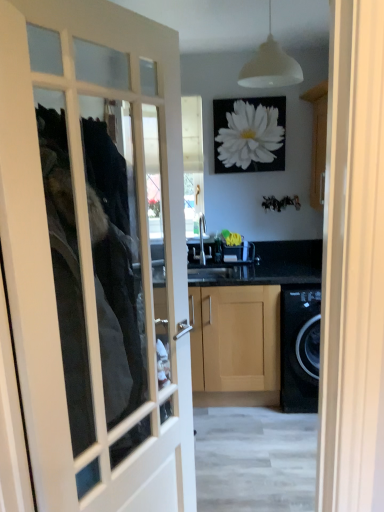
Question: Does white matte light fixture at upper center appear on the right side of white matte flower at upper center?

Choices:
 (A) yes
 (B) no

Answer: (B)

Question: Is white matte flower at upper center completely or partially inside white matte light fixture at upper center?

Choices:
 (A) yes
 (B) no

Answer: (B)

Question: Is white matte light fixture at upper center facing towards white matte flower at upper center?

Choices:
 (A) yes
 (B) no

Answer: (B)

Question: From the image's perspective, would you say white matte light fixture at upper center is shown under white matte flower at upper center?

Choices:
 (A) yes
 (B) no

Answer: (B)

Question: From a real-world perspective, is white matte light fixture at upper center over white matte flower at upper center?

Choices:
 (A) no
 (B) yes

Answer: (B)

Question: Is white matte light fixture at upper center smaller than white matte flower at upper center?

Choices:
 (A) no
 (B) yes

Answer: (A)

Question: Is white matte flower at upper center to the left of white glass door at center from the viewer's perspective?

Choices:
 (A) yes
 (B) no

Answer: (B)

Question: Does white matte flower at upper center contain white glass door at center?

Choices:
 (A) no
 (B) yes

Answer: (A)

Question: Is white matte flower at upper center next to white glass door at center?

Choices:
 (A) no
 (B) yes

Answer: (A)

Question: Is white matte flower at upper center further to the viewer compared to white glass door at center?

Choices:
 (A) no
 (B) yes

Answer: (B)

Question: Does white matte flower at upper center have a smaller size compared to white glass door at center?

Choices:
 (A) yes
 (B) no

Answer: (A)

Question: Does white matte flower at upper center have a greater height compared to white glass door at center?

Choices:
 (A) no
 (B) yes

Answer: (A)

Question: Can you confirm if white glass door at center is positioned to the right of white matte flower at upper center?

Choices:
 (A) no
 (B) yes

Answer: (A)